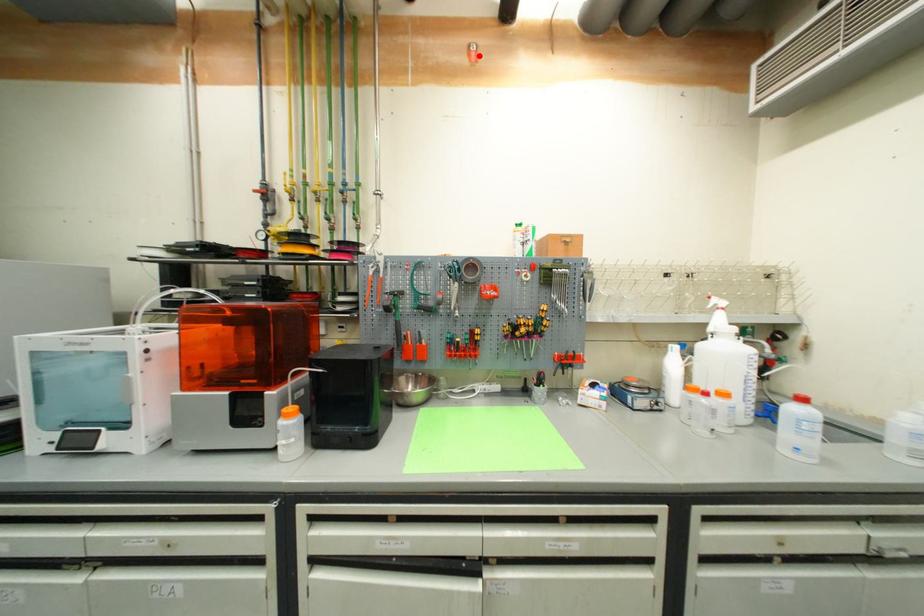
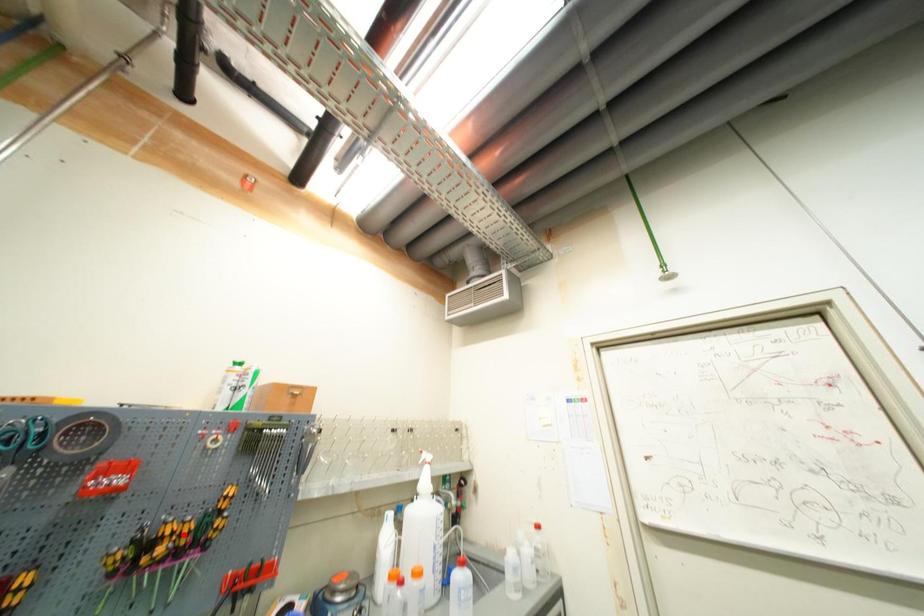
In the scene shown: I am providing you with two images of the same scene from different viewpoints. A red point is marked on the first image and another point is marked on the second image. Are the points marked in image1 and image2 representing the same 3D position?

No